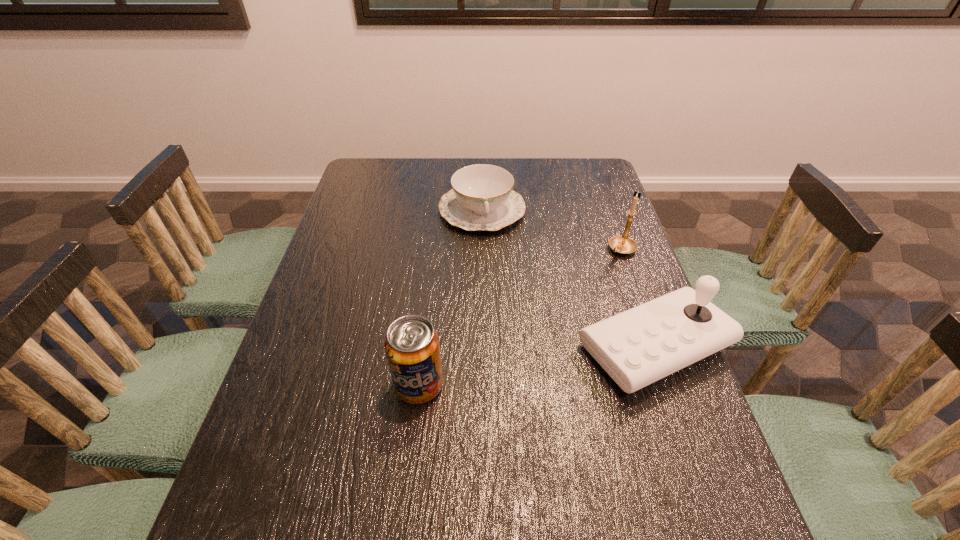
At what (x,y) coordinates should I click in order to perform the action: click on vacant space on the desktop that is between the soda can and the joystick and is positioned on the handle side of the candle holder. Please return your answer as a coordinate pair (x, y). Looking at the image, I should click on (506, 370).

Where is `vacant space on the desktop that is between the soda can and the joystick and is positioned on the handle side of the shortest object`? The image size is (960, 540). vacant space on the desktop that is between the soda can and the joystick and is positioned on the handle side of the shortest object is located at coordinates (509, 370).